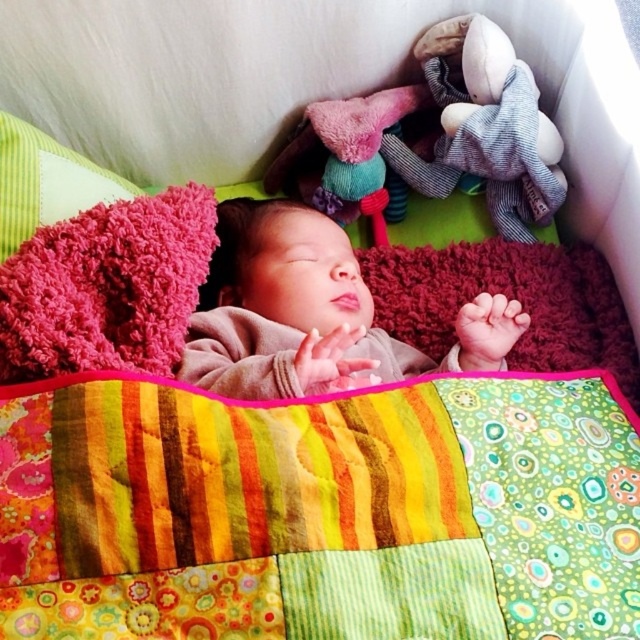
Question: Which object is closer to the camera taking this photo?

Choices:
 (A) multicolored patchwork quilt at center
 (B) soft plush toy at upper right
 (C) soft pink blanket at center
 (D) fuzzy pink pillow at upper left

Answer: (A)

Question: Can you confirm if soft pink blanket at center is smaller than fuzzy pink pillow at upper left?

Choices:
 (A) yes
 (B) no

Answer: (B)

Question: Does soft pink blanket at center appear under fuzzy pink pillow at upper left?

Choices:
 (A) no
 (B) yes

Answer: (B)

Question: Does multicolored patchwork quilt at center appear under fuzzy pink pillow at upper left?

Choices:
 (A) no
 (B) yes

Answer: (B)

Question: Which object is the farthest from the fuzzy pink pillow at upper left?

Choices:
 (A) soft pink blanket at center
 (B) soft plush toy at upper right
 (C) multicolored patchwork quilt at center

Answer: (B)

Question: Which point is farther to the camera?

Choices:
 (A) (465, 336)
 (B) (6, 157)

Answer: (B)